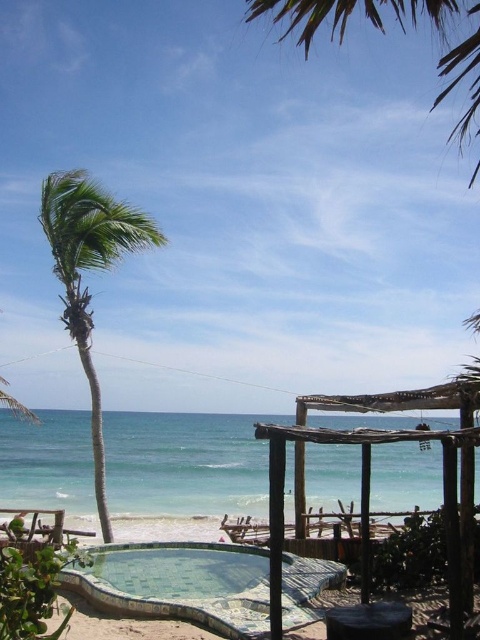
Question: Based on their relative distances, which object is nearer to the green leafy palm tree at upper center?

Choices:
 (A) mosaic tiled pool at center
 (B) green leafy palm tree at left
 (C) wooden pergola at center

Answer: (A)

Question: Is the position of mosaic tiled pool at center less distant than that of green leafy palm tree at upper center?

Choices:
 (A) no
 (B) yes

Answer: (A)

Question: Is wooden pergola at center above green leafy palm tree at left?

Choices:
 (A) yes
 (B) no

Answer: (B)

Question: Can you confirm if green leafy palm tree at left is thinner than green leafy palm tree at upper center?

Choices:
 (A) yes
 (B) no

Answer: (A)

Question: Which of these objects is positioned closest to the wooden pergola at center?

Choices:
 (A) mosaic tiled pool at center
 (B) green leafy palm tree at upper center

Answer: (A)

Question: Which point is farther to the camera?

Choices:
 (A) (444, 12)
 (B) (254, 557)
 (C) (130, 212)
 (D) (466, 397)

Answer: (C)